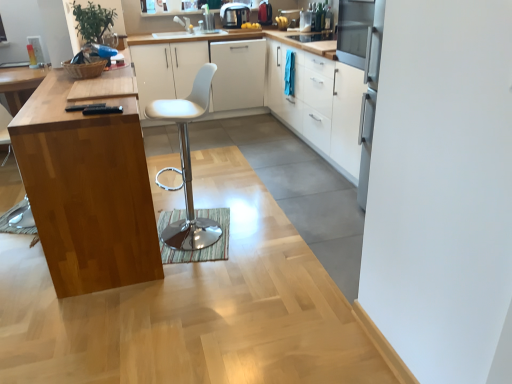
The width and height of the screenshot is (512, 384). In order to click on empty space that is ontop of wooden cutting board at left (from a real-world perspective) in this screenshot , I will do `click(91, 82)`.